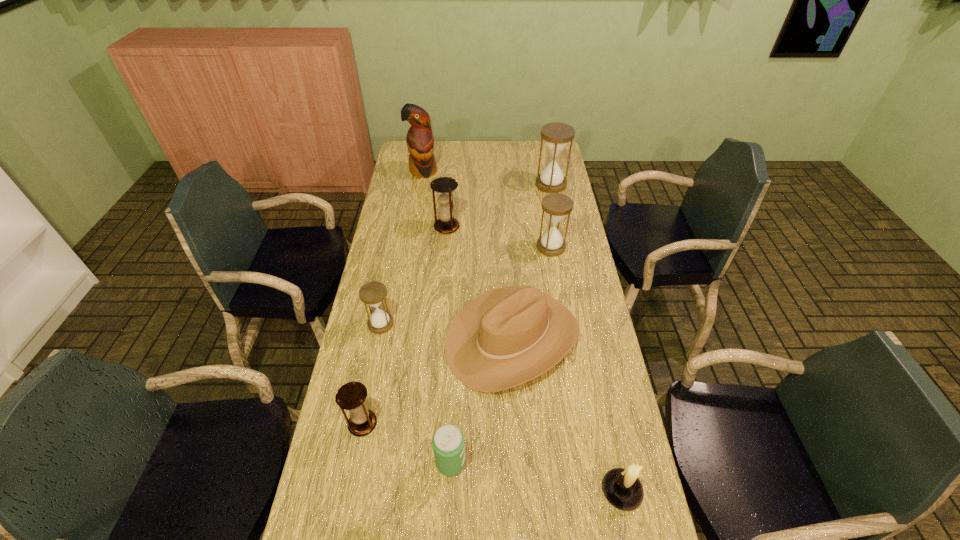
The width and height of the screenshot is (960, 540). In order to click on the smallest white hourglass in this screenshot , I will do `click(373, 293)`.

Identify the location of the third nearest object. The height and width of the screenshot is (540, 960). (351, 396).

You are a GUI agent. You are given a task and a screenshot of the screen. Output one action in this format:
    pyautogui.click(x=<x>, y=<y>)
    Task: Click on the smaller brown hourglass
    The width and height of the screenshot is (960, 540).
    Given the screenshot: What is the action you would take?
    pyautogui.click(x=351, y=396)

This screenshot has height=540, width=960. In order to click on candle holder in this screenshot , I will do `click(622, 488)`.

Image resolution: width=960 pixels, height=540 pixels. Identify the location of soda. (448, 443).

At what (x,y) coordinates should I click in order to perform the action: click on free space located on the face of the parrot. Please return your answer as a coordinate pair (x, y). The width and height of the screenshot is (960, 540). Looking at the image, I should click on (419, 198).

Locate an element on the screen. This screenshot has width=960, height=540. vacant space situated on the front of the biggest white hourglass is located at coordinates (556, 208).

Where is `free point located 0.120m on the right of the third hourglass from right to left`? The image size is (960, 540). free point located 0.120m on the right of the third hourglass from right to left is located at coordinates (489, 227).

Where is `blank space located on the front of the sixth nearest object`? Image resolution: width=960 pixels, height=540 pixels. blank space located on the front of the sixth nearest object is located at coordinates (562, 313).

I want to click on vacant area situated on the front of the cowboy hat, so click(x=523, y=512).